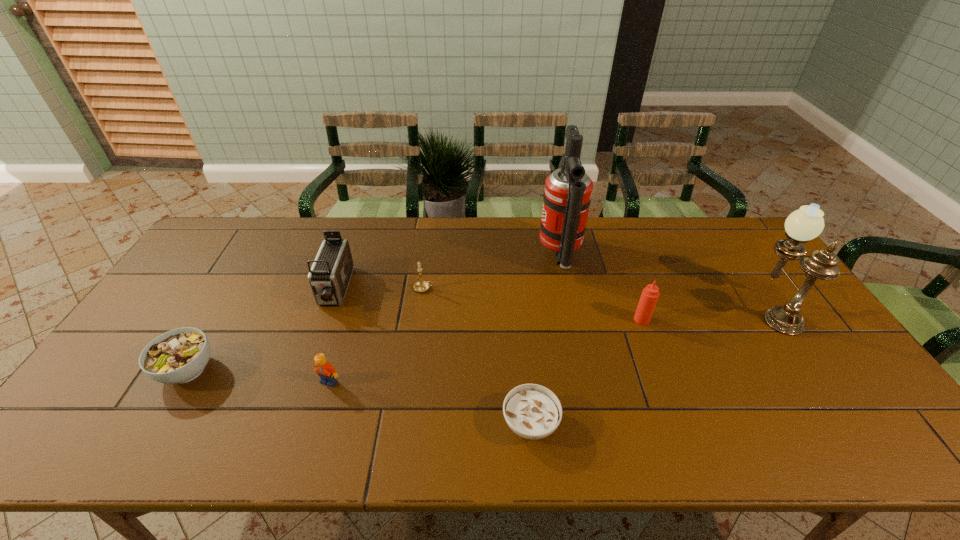
In the image, there is a desktop. Identify the location of free space at the near left corner. The height and width of the screenshot is (540, 960). (91, 420).

In the image, there is a desktop. Identify the location of vacant space at the far right corner. (734, 224).

Where is `free space that is in between the fourth object from left to right and the right soup bowl`? Image resolution: width=960 pixels, height=540 pixels. free space that is in between the fourth object from left to right and the right soup bowl is located at coordinates (477, 356).

I want to click on vacant region between the farther soup bowl and the Lego, so click(x=258, y=376).

The height and width of the screenshot is (540, 960). In order to click on vacant area between the nearest object and the Tabasco sauce in this screenshot , I will do `click(587, 372)`.

Find the location of a particular element. vacant region between the Lego and the second tallest object is located at coordinates (552, 345).

The image size is (960, 540). I want to click on empty space between the Tabasco sauce and the farther soup bowl, so click(x=415, y=345).

The image size is (960, 540). What are the coordinates of `vacant point located between the rightmost object and the seventh object from left to right` in the screenshot? It's located at (708, 314).

Where is `free space between the camcorder and the leftmost object`? free space between the camcorder and the leftmost object is located at coordinates (x=261, y=330).

Where is `free point between the second object from right to left and the Lego`? This screenshot has height=540, width=960. free point between the second object from right to left and the Lego is located at coordinates (486, 350).